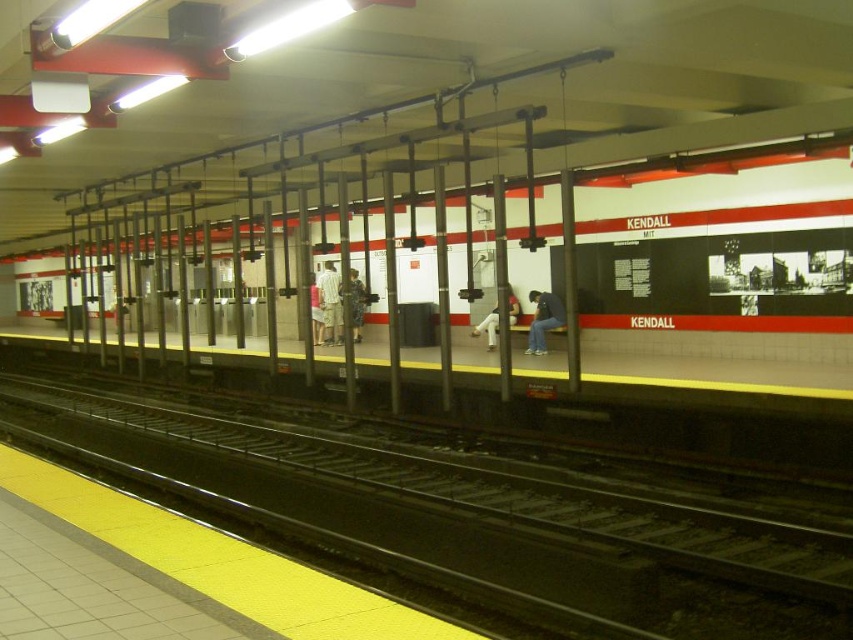
Is black metal track at center wider than light gray shorts at center?

Yes, black metal track at center is wider than light gray shorts at center.

Does point (587, 554) come behind point (337, 276)?

No.

Who is more distant from viewer, (817, 577) or (323, 276)?

Point (323, 276)

Where is `black metal track at center`? This screenshot has height=640, width=853. black metal track at center is located at coordinates (471, 515).

Is light gray fabric jacket at center to the right of light brown fabric shorts at center from the viewer's perspective?

Yes, light gray fabric jacket at center is to the right of light brown fabric shorts at center.

This screenshot has height=640, width=853. In order to click on light gray fabric jacket at center in this screenshot , I will do `click(355, 301)`.

Which is behind, point (772, 625) or point (541, 348)?

Positioned behind is point (541, 348).

Which is more to the left, black metal track at center or denim jacket at center?

Positioned to the left is black metal track at center.

Who is more forward, (102, 422) or (563, 308)?

Point (102, 422) is in front.

Locate an element on the screen. The width and height of the screenshot is (853, 640). black metal track at center is located at coordinates (471, 515).